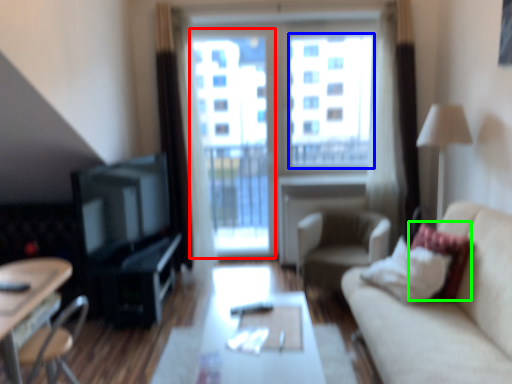
Question: Which object is positioned farthest from screen door (highlighted by a red box)? Select from window screen (highlighted by a blue box) and pillow (highlighted by a green box).

Choices:
 (A) window screen
 (B) pillow

Answer: (B)